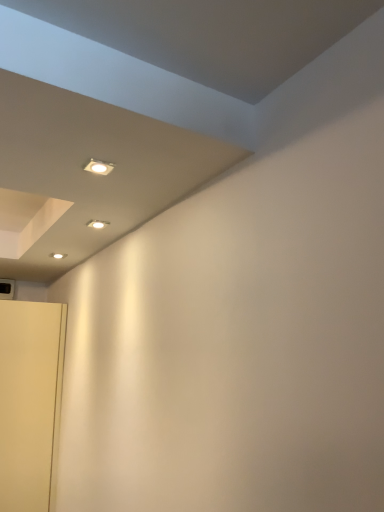
What do you see at coordinates (30, 402) in the screenshot?
I see `white matte door at lower left` at bounding box center [30, 402].

What are the coordinates of `white matte door at lower left` in the screenshot? It's located at (30, 402).

In order to click on matte white light fixture at upper center in this screenshot , I will do `click(99, 167)`.

What do you see at coordinates (99, 167) in the screenshot?
I see `matte white light fixture at upper center` at bounding box center [99, 167].

Identify the location of white matte door at lower left. The height and width of the screenshot is (512, 384). (30, 402).

Which object is positioned more to the left, white matte door at lower left or matte white light fixture at upper center?

white matte door at lower left.

Is the depth of white matte door at lower left less than that of matte white light fixture at upper center?

No.

Is point (33, 466) farther from camera compared to point (92, 168)?

Yes, it is.

From the image's perspective, which is below, white matte door at lower left or matte white light fixture at upper center?

white matte door at lower left.

From a real-world perspective, between white matte door at lower left and matte white light fixture at upper center, who is vertically lower?

In real-world perspective, white matte door at lower left is lower.

Can you confirm if white matte door at lower left is thinner than matte white light fixture at upper center?

No.

Who is taller, white matte door at lower left or matte white light fixture at upper center?

white matte door at lower left.

In the scene shown: Can you confirm if white matte door at lower left is smaller than matte white light fixture at upper center?

No.

Do you think white matte door at lower left is within matte white light fixture at upper center, or outside of it?

white matte door at lower left is not inside matte white light fixture at upper center, it's outside.

Based on the photo, are white matte door at lower left and matte white light fixture at upper center beside each other?

→ No, white matte door at lower left is not in contact with matte white light fixture at upper center.

Is white matte door at lower left aimed at matte white light fixture at upper center?

Yes, white matte door at lower left is turned towards matte white light fixture at upper center.

Can you tell me how much white matte door at lower left and matte white light fixture at upper center differ in facing direction?

The facing directions of white matte door at lower left and matte white light fixture at upper center are 179 degrees apart.

Locate an element on the screen. This screenshot has width=384, height=512. light fixture located above the white matte door at lower left (from a real-world perspective) is located at coordinates click(99, 167).

Does matte white light fixture at upper center appear on the right side of white matte door at lower left?

Indeed, matte white light fixture at upper center is positioned on the right side of white matte door at lower left.

Which object is further away from the camera taking this photo, matte white light fixture at upper center or white matte door at lower left?

white matte door at lower left is more distant.

Between point (96, 174) and point (20, 423), which one is positioned behind?

The point (20, 423) is more distant.

From the image's perspective, is matte white light fixture at upper center under white matte door at lower left?

Incorrect, from the image's perspective, matte white light fixture at upper center is higher than white matte door at lower left.

From a real-world perspective, is matte white light fixture at upper center positioned above or below white matte door at lower left?

matte white light fixture at upper center is above white matte door at lower left.

Between matte white light fixture at upper center and white matte door at lower left, which one has larger width?

white matte door at lower left is wider.

Considering the relative sizes of matte white light fixture at upper center and white matte door at lower left in the image provided, is matte white light fixture at upper center taller than white matte door at lower left?

No, matte white light fixture at upper center is not taller than white matte door at lower left.

In the scene shown: Between matte white light fixture at upper center and white matte door at lower left, which one has larger size?

With larger size is white matte door at lower left.

Is matte white light fixture at upper center located outside white matte door at lower left?

Yes, matte white light fixture at upper center is not within white matte door at lower left.

Is matte white light fixture at upper center directly adjacent to white matte door at lower left?

No, matte white light fixture at upper center is not touching white matte door at lower left.

Is matte white light fixture at upper center turned away from white matte door at lower left?

No, matte white light fixture at upper center is not facing away from white matte door at lower left.

How much distance is there between matte white light fixture at upper center and white matte door at lower left?

The distance of matte white light fixture at upper center from white matte door at lower left is 5.82 feet.

I want to click on door below the matte white light fixture at upper center (from a real-world perspective), so click(30, 402).

Image resolution: width=384 pixels, height=512 pixels. In order to click on door that appears behind the matte white light fixture at upper center in this screenshot , I will do `click(30, 402)`.

Where is `door below the matte white light fixture at upper center (from a real-world perspective)`? This screenshot has height=512, width=384. door below the matte white light fixture at upper center (from a real-world perspective) is located at coordinates (30, 402).